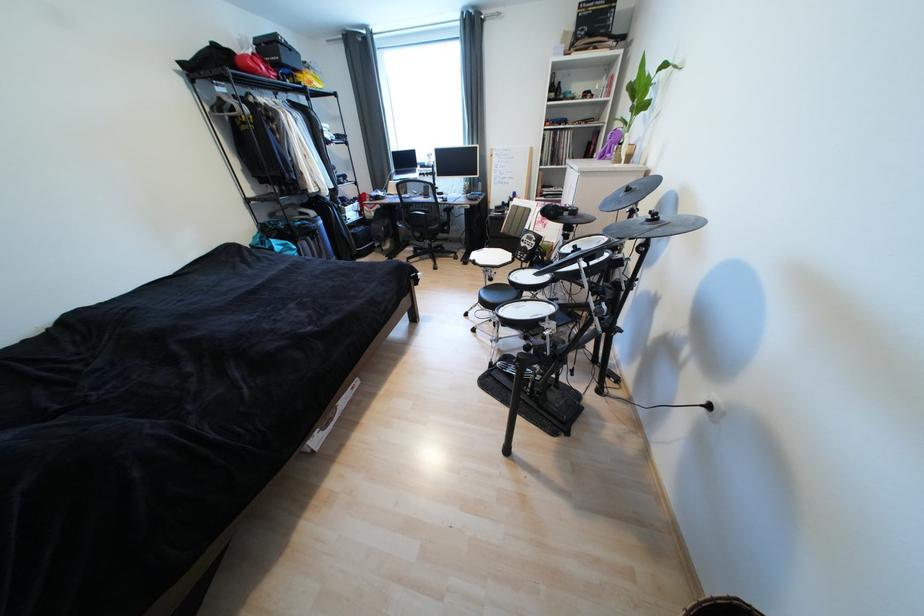
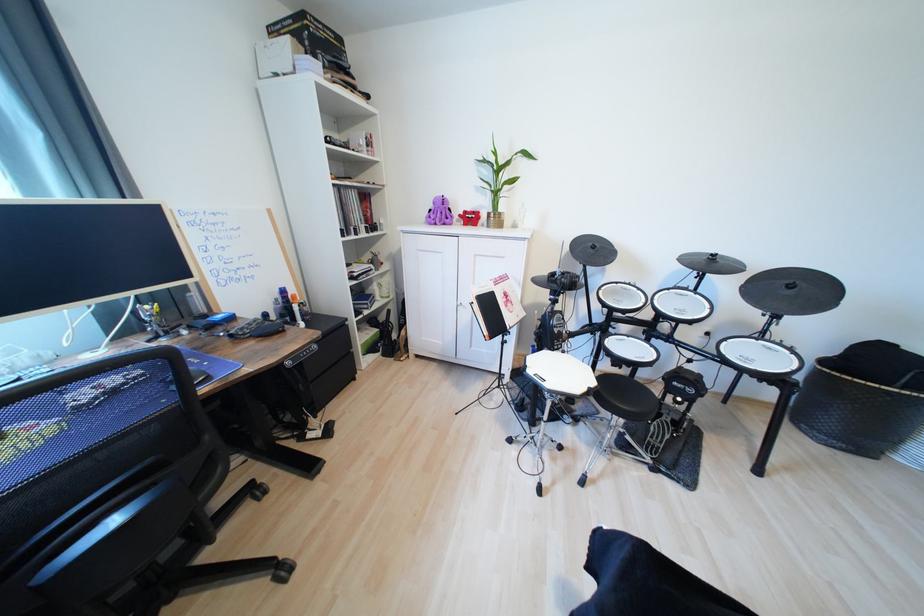
Find the pixel in the second image that matches the point at 628,196 in the first image.

(599, 252)